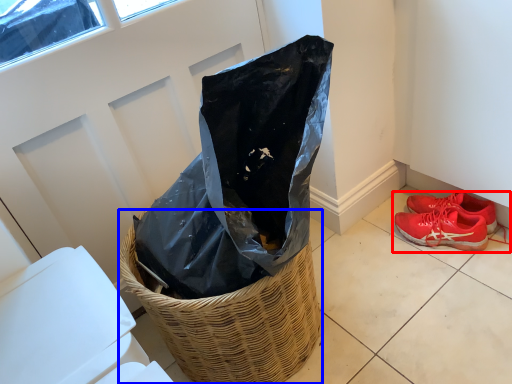
Question: Among these objects, which one is farthest to the camera, footwear (highlighted by a red box) or basket (highlighted by a blue box)?

Choices:
 (A) footwear
 (B) basket

Answer: (A)